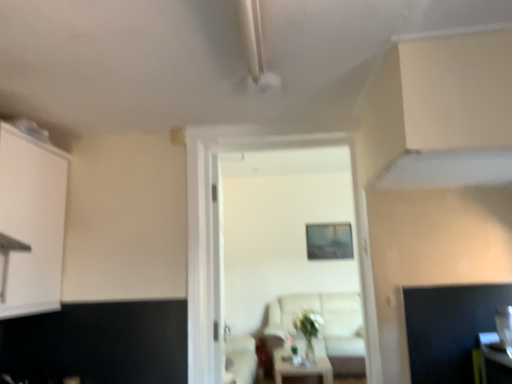
Question: Is white matte cabinet at left further to the viewer compared to beige fabric couch at center?

Choices:
 (A) yes
 (B) no

Answer: (B)

Question: Does white matte cabinet at left have a smaller size compared to beige fabric couch at center?

Choices:
 (A) no
 (B) yes

Answer: (B)

Question: Can you confirm if white matte cabinet at left is thinner than beige fabric couch at center?

Choices:
 (A) yes
 (B) no

Answer: (A)

Question: Can you confirm if white matte cabinet at left is taller than beige fabric couch at center?

Choices:
 (A) yes
 (B) no

Answer: (B)

Question: Is white matte cabinet at left completely or partially outside of beige fabric couch at center?

Choices:
 (A) no
 (B) yes

Answer: (B)

Question: Visually, is white wooden door at center positioned to the left or to the right of white glossy table at center?

Choices:
 (A) right
 (B) left

Answer: (B)

Question: From the image's perspective, is white wooden door at center above or below white glossy table at center?

Choices:
 (A) above
 (B) below

Answer: (A)

Question: Considering the positions of white wooden door at center and white glossy table at center in the image, is white wooden door at center taller or shorter than white glossy table at center?

Choices:
 (A) short
 (B) tall

Answer: (B)

Question: In the image, is white wooden door at center positioned in front of or behind white glossy table at center?

Choices:
 (A) front
 (B) behind

Answer: (A)

Question: From a real-world perspective, is transparent glass door at center positioned above or below white wooden door at center?

Choices:
 (A) above
 (B) below

Answer: (B)

Question: Considering the positions of point (220, 281) and point (362, 233), is point (220, 281) closer or farther from the camera than point (362, 233)?

Choices:
 (A) closer
 (B) farther

Answer: (B)

Question: Visually, is transparent glass door at center positioned to the left or to the right of white wooden door at center?

Choices:
 (A) right
 (B) left

Answer: (B)

Question: Is transparent glass door at center taller or shorter than white wooden door at center?

Choices:
 (A) tall
 (B) short

Answer: (A)

Question: Is white wooden door at center situated inside transparent glass door at center or outside?

Choices:
 (A) inside
 (B) outside

Answer: (B)

Question: Is point (200, 195) closer or farther from the camera than point (217, 309)?

Choices:
 (A) farther
 (B) closer

Answer: (B)